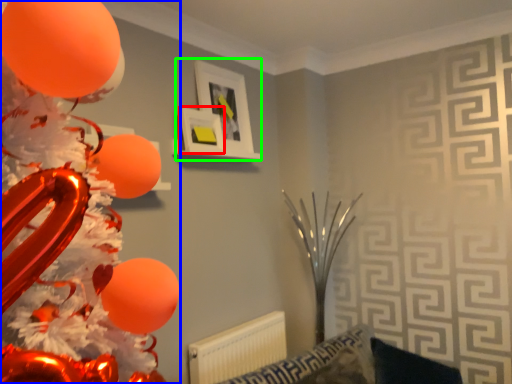
Question: Based on their relative distances, which object is farther from picture frame (highlighted by a red box)? Choose from balloon (highlighted by a blue box) and picture frame (highlighted by a green box).

Choices:
 (A) balloon
 (B) picture frame

Answer: (A)